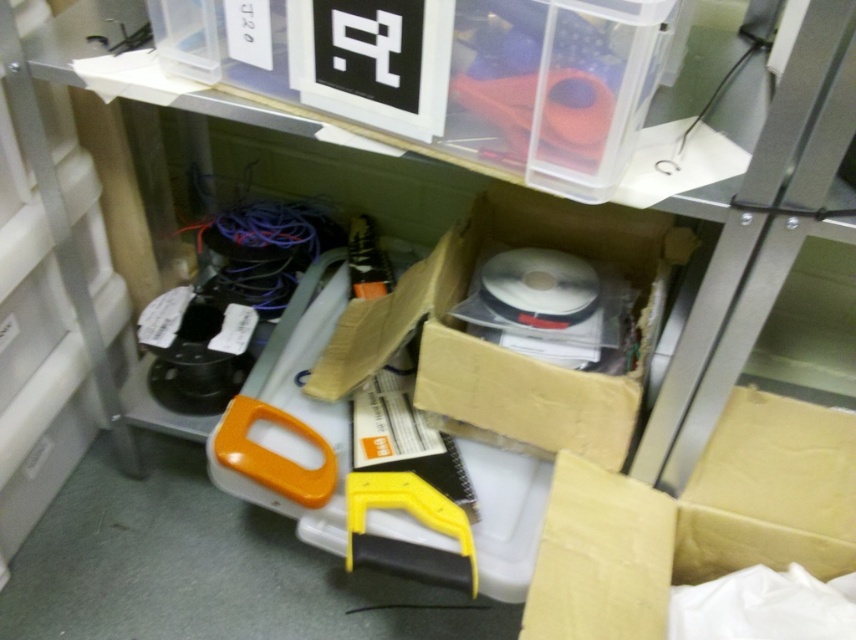
You are organizing items in the storage area and need to place a new item on the shelf. You have two options for placement near the brown cardboard box at lower right and the cardboard box at center. Which box should you choose to place the item closer to the front of the shelf?

You should place the item near the brown cardboard box at lower right because it is closer to the viewer, meaning it is positioned at the front of the shelf compared to the cardboard box at center.

You are organizing the storage area and want to place a new item between the brown cardboard box at lower right and the cardboard box at center. Is there enough space between them to fit a standard size box?

The brown cardboard box at lower right is positioned on the right side of the cardboard box at center, so there is space between them to fit a standard size box.